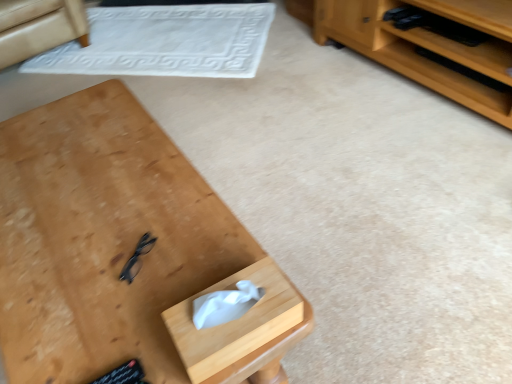
You are a GUI agent. You are given a task and a screenshot of the screen. Output one action in this format:
    pyautogui.click(x=<x>, y=<y>)
    Task: Click on the white textured mat at upper center
    The image size is (512, 384).
    Given the screenshot: What is the action you would take?
    pyautogui.click(x=165, y=42)

From the image's perspective, would you say wooden tissue box at lower center is shown under beige fabric armchair at upper left?

Indeed, from the image's perspective, wooden tissue box at lower center is shown beneath beige fabric armchair at upper left.

Does wooden tissue box at lower center have a smaller size compared to beige fabric armchair at upper left?

Yes, wooden tissue box at lower center is smaller than beige fabric armchair at upper left.

In the scene shown: Is wooden tissue box at lower center far away from beige fabric armchair at upper left?

wooden tissue box at lower center is far away from beige fabric armchair at upper left.

Is wooden tissue box at lower center aimed at beige fabric armchair at upper left?

No, wooden tissue box at lower center does not turn towards beige fabric armchair at upper left.

Identify the location of mat below the wooden desk at center (from a real-world perspective). (165, 42).

In the scene shown: Is white textured mat at upper center surrounding wooden desk at center?

No, white textured mat at upper center does not contain wooden desk at center.

Can you confirm if white textured mat at upper center is wider than wooden desk at center?

Yes.

Between white textured mat at upper center and wooden desk at center, which one is positioned in front?

wooden desk at center is in front.

Is white textured mat at upper center spatially inside beige fabric armchair at upper left, or outside of it?

white textured mat at upper center exists outside the volume of beige fabric armchair at upper left.

Can you confirm if white textured mat at upper center is smaller than beige fabric armchair at upper left?

Indeed, white textured mat at upper center has a smaller size compared to beige fabric armchair at upper left.

Locate an element on the screen. This screenshot has width=512, height=384. mat that is on the right side of beige fabric armchair at upper left is located at coordinates (165, 42).

Considering the relative positions of white textured mat at upper center and beige fabric armchair at upper left in the image provided, is white textured mat at upper center to the right of beige fabric armchair at upper left from the viewer's perspective?

Yes, white textured mat at upper center is to the right of beige fabric armchair at upper left.

Looking at the image, does beige fabric armchair at upper left seem bigger or smaller compared to wooden tissue box at lower center?

In the image, beige fabric armchair at upper left appears to be larger than wooden tissue box at lower center.

From the picture: Does beige fabric armchair at upper left have a greater width compared to wooden tissue box at lower center?

Indeed, beige fabric armchair at upper left has a greater width compared to wooden tissue box at lower center.

What are the coordinates of `armchair that is under the wooden tissue box at lower center (from a real-world perspective)` in the screenshot? It's located at (38, 27).

Does white textured mat at upper center lie in front of wooden tissue box at lower center?

No, white textured mat at upper center is further to the viewer.

Image resolution: width=512 pixels, height=384 pixels. In order to click on drawer that is on the right side of white textured mat at upper center in this screenshot , I will do `click(240, 328)`.

Is white textured mat at upper center taller than wooden tissue box at lower center?

No.

Who is smaller, white textured mat at upper center or wooden tissue box at lower center?

With smaller size is wooden tissue box at lower center.

Does wooden desk at center have a greater height compared to wooden tissue box at lower center?

Yes, wooden desk at center is taller than wooden tissue box at lower center.

Who is more distant, wooden desk at center or wooden tissue box at lower center?

wooden tissue box at lower center is further away from the camera.

Is wooden desk at center facing away from wooden tissue box at lower center?

No, wooden desk at center is not facing the opposite direction of wooden tissue box at lower center.

Is wooden tissue box at lower center looking in the opposite direction of wooden desk at center?

No, wooden tissue box at lower center is not facing away from wooden desk at center.

Is point (175, 313) positioned behind point (14, 258)?

That is False.

Are wooden tissue box at lower center and wooden desk at center located far from each other?

No, wooden tissue box at lower center is in close proximity to wooden desk at center.

Between wooden tissue box at lower center and wooden desk at center, which one appears on the right side from the viewer's perspective?

wooden tissue box at lower center is more to the right.

You are a GUI agent. You are given a task and a screenshot of the screen. Output one action in this format:
    pyautogui.click(x=<x>, y=<y>)
    Task: Click on the armchair that appears below the wooden tissue box at lower center (from a real-world perspective)
    This screenshot has width=512, height=384.
    Given the screenshot: What is the action you would take?
    pyautogui.click(x=38, y=27)

Locate an element on the screen. The image size is (512, 384). mat located on the left of wooden desk at center is located at coordinates (165, 42).

From the image, which object appears to be nearer to wooden tissue box at lower center, white textured mat at upper center or beige fabric armchair at upper left?

white textured mat at upper center is positioned closer to the anchor wooden tissue box at lower center.

Looking at this image, from the image, which object appears to be farther from wooden desk at center, beige fabric armchair at upper left or white textured mat at upper center?

beige fabric armchair at upper left.

When comparing their distances from beige fabric armchair at upper left, does wooden tissue box at lower center or wooden desk at center seem closer?

wooden desk at center.

Looking at the image, which one is located further to beige fabric armchair at upper left, wooden desk at center or white textured mat at upper center?

Among the two, wooden desk at center is located further to beige fabric armchair at upper left.

Based on their spatial positions, is wooden desk at center or beige fabric armchair at upper left closer to wooden tissue box at lower center?

Among the two, wooden desk at center is located nearer to wooden tissue box at lower center.

From the image, which object appears to be farther from wooden desk at center, wooden tissue box at lower center or white textured mat at upper center?

white textured mat at upper center lies further to wooden desk at center than the other object.

Looking at the image, which one is located further to wooden desk at center, wooden tissue box at lower center or beige fabric armchair at upper left?

Based on the image, beige fabric armchair at upper left appears to be further to wooden desk at center.

Which object lies further to the anchor point white textured mat at upper center, beige fabric armchair at upper left or wooden tissue box at lower center?

wooden tissue box at lower center is positioned further to the anchor white textured mat at upper center.

Locate an element on the screen. armchair between wooden tissue box at lower center and white textured mat at upper center from front to back is located at coordinates (38, 27).

Find the location of a particular element. This screenshot has height=384, width=512. drawer between wooden desk at center and white textured mat at upper center along the z-axis is located at coordinates (240, 328).

Find the location of a particular element. Image resolution: width=512 pixels, height=384 pixels. drawer between wooden desk at center and beige fabric armchair at upper left along the z-axis is located at coordinates (240, 328).

Locate an element on the screen. The height and width of the screenshot is (384, 512). armchair between wooden desk at center and white textured mat at upper center from front to back is located at coordinates (38, 27).